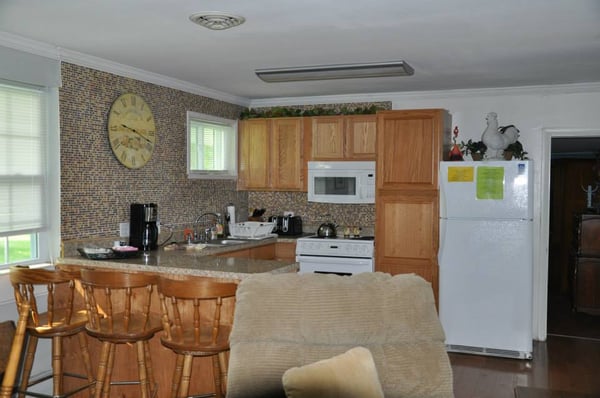
I want to click on coffee machine, so click(146, 219).